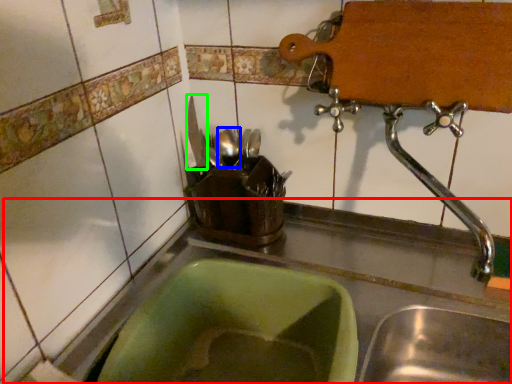
Question: Considering the real-world distances, which object is closest to counter top (highlighted by a red box)? tableware (highlighted by a blue box) or tableware (highlighted by a green box).

Choices:
 (A) tableware
 (B) tableware

Answer: (A)